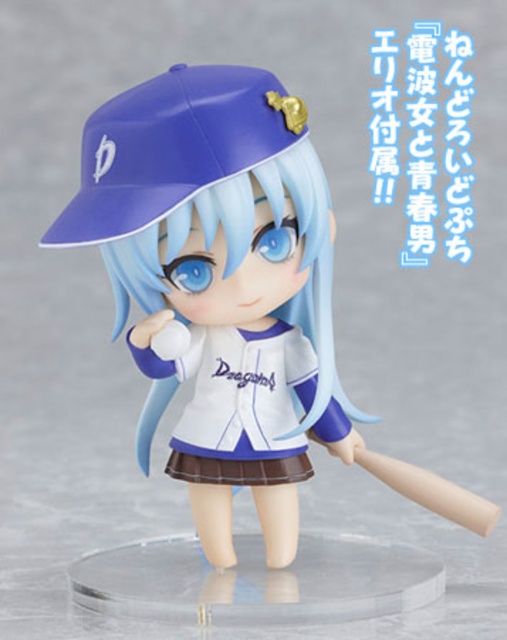
Does matte blue baseball cap at upper center appear under beige matte baseball bat at center?

Incorrect, matte blue baseball cap at upper center is not positioned below beige matte baseball bat at center.

Identify the location of matte blue baseball cap at upper center. This screenshot has height=640, width=507. (172, 147).

Looking at this image, who is more distant from viewer, (122, 115) or (457, 493)?

The point (457, 493) is behind.

Identify the location of matte blue baseball cap at upper center. (172, 147).

Who is more distant from viewer, (126, 234) or (224, 140)?

Point (224, 140)

Is white matte baseball cap at upper center below matte blue baseball cap at upper center?

Yes.

Who is more distant from viewer, (271, 276) or (194, 125)?

The point (271, 276) is behind.

At what (x,y) coordinates should I click in order to perform the action: click on white matte baseball cap at upper center. Please return your answer as a coordinate pair (x, y). This screenshot has width=507, height=640. Looking at the image, I should click on (219, 269).

Between white matte baseball uniform at center and beige matte baseball bat at center, which one appears on the right side from the viewer's perspective?

beige matte baseball bat at center

Locate an element on the screen. The width and height of the screenshot is (507, 640). white matte baseball uniform at center is located at coordinates (239, 392).

Between point (258, 362) and point (473, 513), which one is positioned behind?

The point (258, 362) is behind.

What are the coordinates of `white matte baseball uniform at center` in the screenshot? It's located at (239, 392).